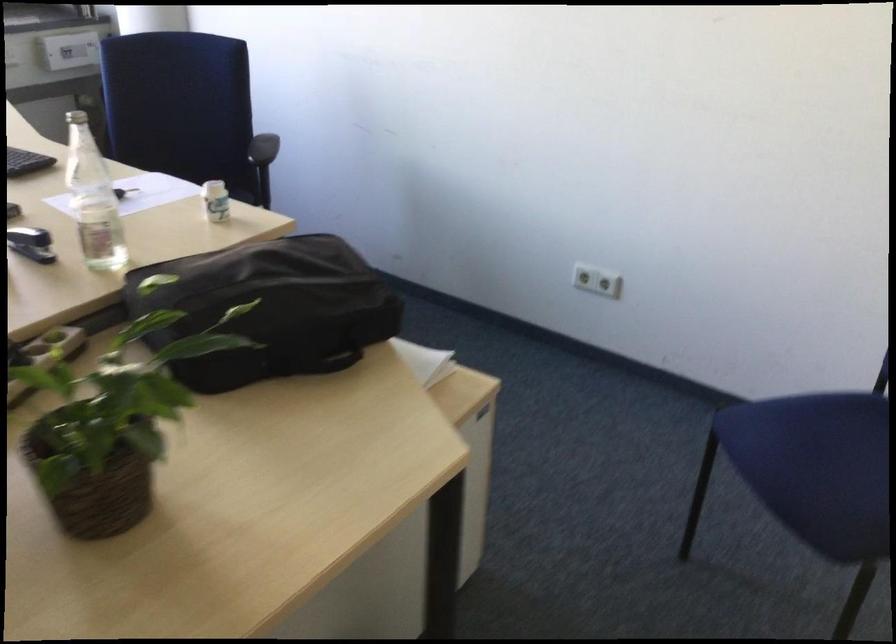
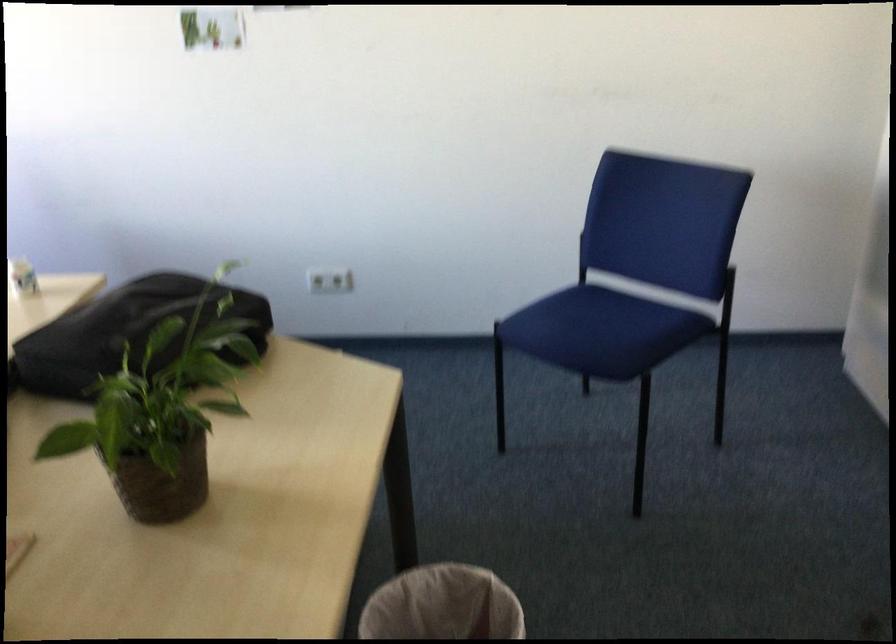
Locate, in the second image, the point that corresponds to (x=214, y=301) in the first image.

(125, 333)